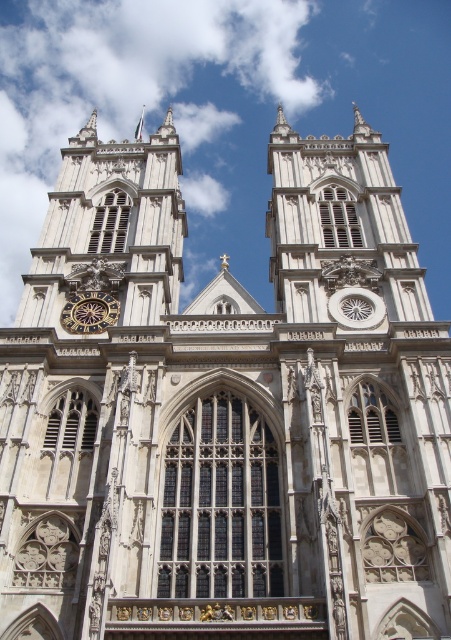
Which is in front, point (107, 268) or point (102, 298)?

Point (102, 298) is more forward.

Does white stone clock tower at upper left come behind goldmetallicclock at lower center?

No, it is in front of goldmetallicclock at lower center.

Does point (124, 218) come closer to viewer compared to point (92, 305)?

No, it is not.

You are a GUI agent. You are given a task and a screenshot of the screen. Output one action in this format:
    pyautogui.click(x=<x>, y=<y>)
    Task: Click on the white stone clock tower at upper left
    Image resolution: width=451 pixels, height=640 pixels.
    Given the screenshot: What is the action you would take?
    pyautogui.click(x=110, y=234)

Between white fluffy cloud at upper center and goldmetallicclock at lower center, which one has more height?

With more height is white fluffy cloud at upper center.

Can you confirm if white fluffy cloud at upper center is taller than goldmetallicclock at lower center?

Yes.

Consider the image. Who is more forward, (302, 86) or (105, 321)?

Point (105, 321) is more forward.

Image resolution: width=451 pixels, height=640 pixels. I want to click on white fluffy cloud at upper center, so click(x=151, y=108).

Is point (63, 77) positioned behind point (128, 189)?

Yes, it is behind point (128, 189).

Can you confirm if white fluffy cloud at upper center is taller than white stone clock tower at upper left?

Indeed, white fluffy cloud at upper center has a greater height compared to white stone clock tower at upper left.

I want to click on white fluffy cloud at upper center, so click(x=151, y=108).

This screenshot has height=640, width=451. Find the location of `white fluffy cloud at upper center`. white fluffy cloud at upper center is located at coordinates (151, 108).